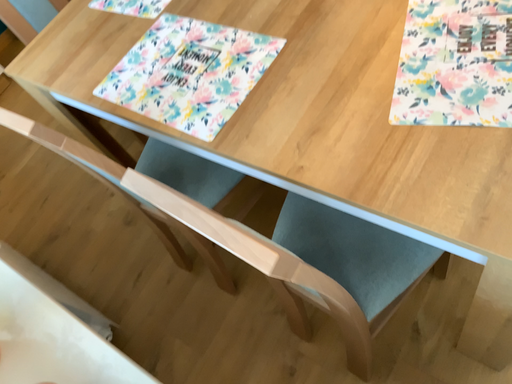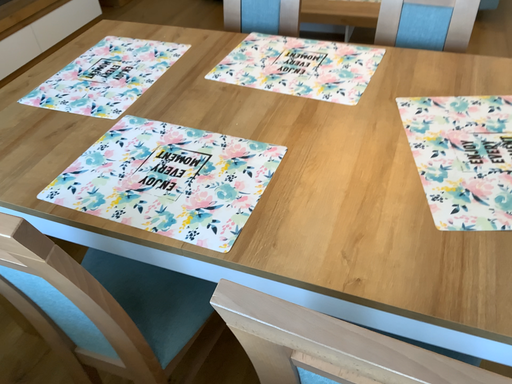
Question: How did the camera likely rotate when shooting the video?

Choices:
 (A) rotated upward
 (B) rotated downward

Answer: (A)